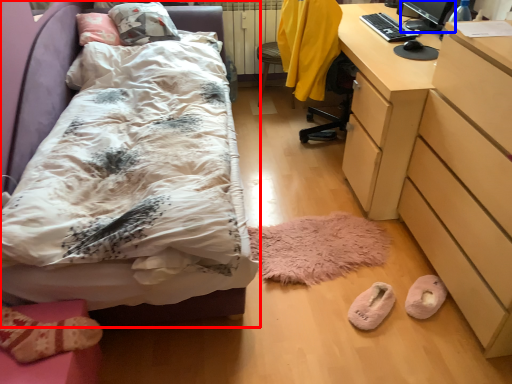
Question: Which object is closer to the camera taking this photo, bed (highlighted by a red box) or computer monitor (highlighted by a blue box)?

Choices:
 (A) bed
 (B) computer monitor

Answer: (A)